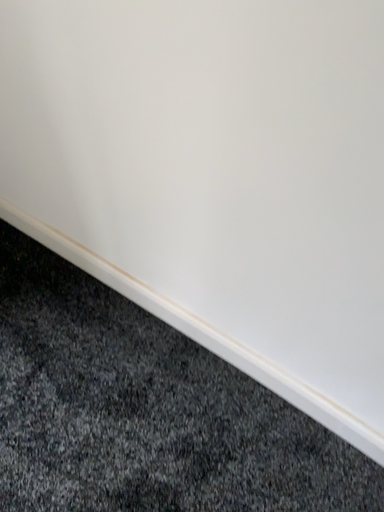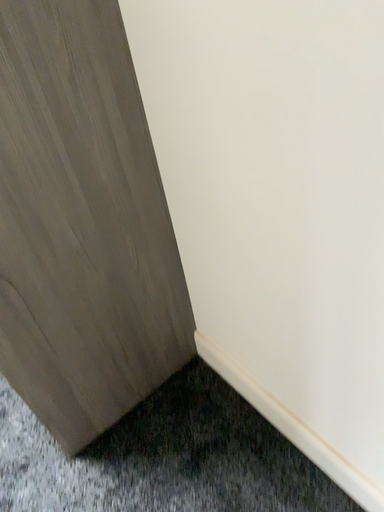
Question: How did the camera likely rotate when shooting the video?

Choices:
 (A) rotated left
 (B) rotated right

Answer: (A)